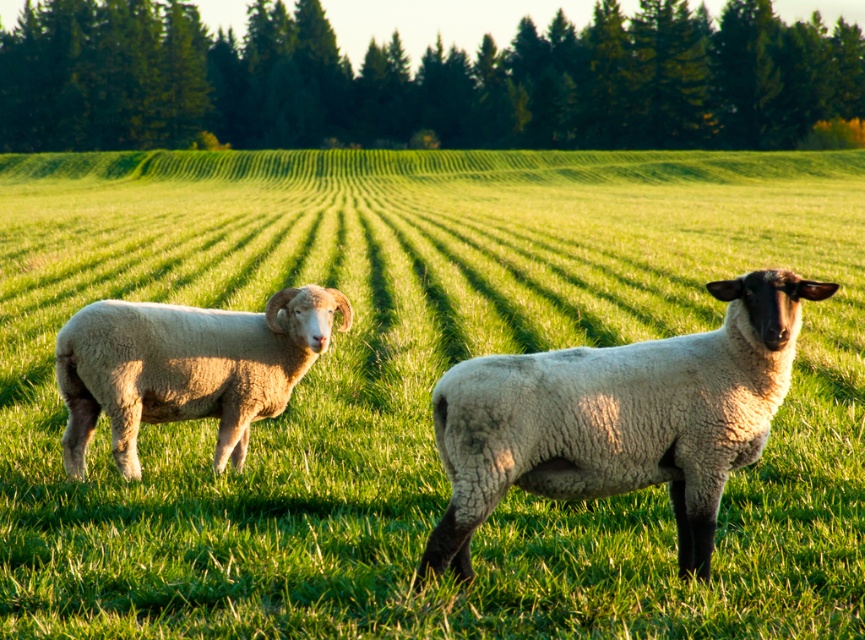
Question: Which point appears farthest from the camera in this image?

Choices:
 (A) (165, 408)
 (B) (566, 420)

Answer: (A)

Question: Is white woolly sheep at center wider than light brown woolly ram at left?

Choices:
 (A) yes
 (B) no

Answer: (A)

Question: Is white woolly sheep at center to the left of light brown woolly ram at left from the viewer's perspective?

Choices:
 (A) yes
 (B) no

Answer: (B)

Question: Is white woolly sheep at center further to camera compared to light brown woolly ram at left?

Choices:
 (A) no
 (B) yes

Answer: (A)

Question: Which object appears farthest from the camera in this image?

Choices:
 (A) light brown woolly ram at left
 (B) white woolly sheep at center

Answer: (A)